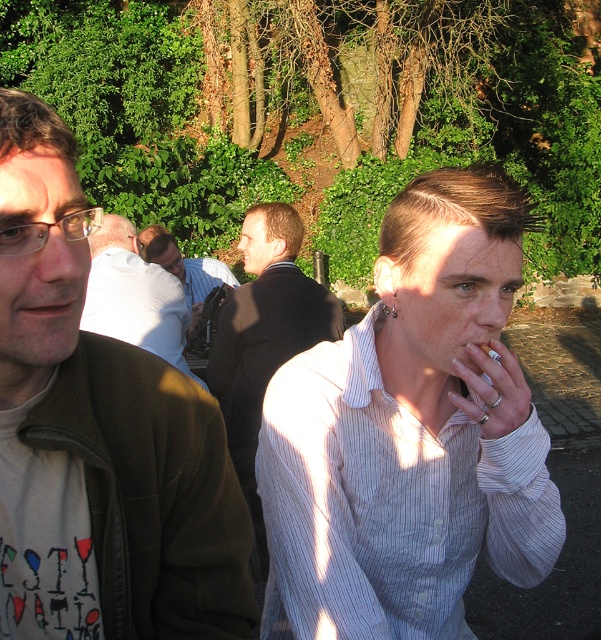
Based on the photo, you are a photographer trying to capture a candid shot of both the white striped shirt at center and the white shirt at center. Since you want to ensure both are in focus, you need to know their vertical positions. Which one is positioned lower in the image?

The white striped shirt at center is located below white shirt at center, so the white striped shirt at center is positioned lower in the image.

Looking at this image, based on the scene description, which of the two points, point (x=480, y=381) or point (x=7, y=602), is located further away from the viewer?

Point (x=480, y=381) is located further away from the viewer than point (x=7, y=602) because it is described as being behind the other point.

You are a photographer trying to capture a candid shot of the two men in the scene. You notice that the white striped shirt at center and the matte brown jacket at left are partially overlapping. Which object should you focus on to ensure the entire subject is in frame without cropping?

The white striped shirt at center is larger in size than the matte brown jacket at left, so focusing on the white striped shirt at center would ensure the entire subject is in frame without cropping.